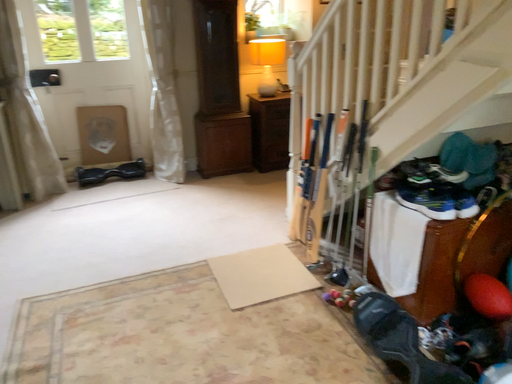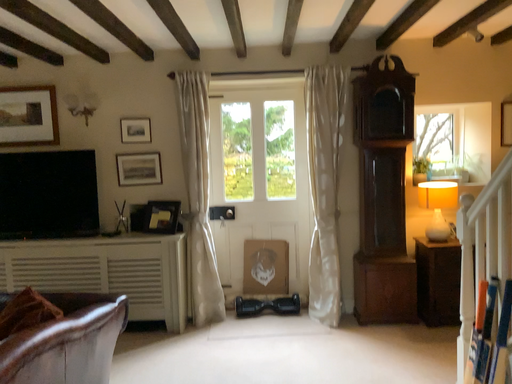
Question: Which way did the camera rotate in the video?

Choices:
 (A) rotated right
 (B) rotated left

Answer: (B)